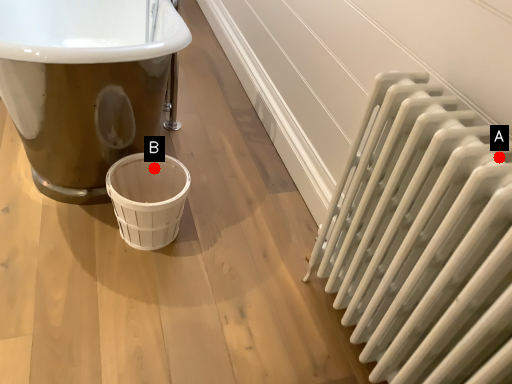
Question: Two points are circled on the image, labeled by A and B beside each circle. Among these points, which one is nearest to the camera?

Choices:
 (A) A is closer
 (B) B is closer

Answer: (A)